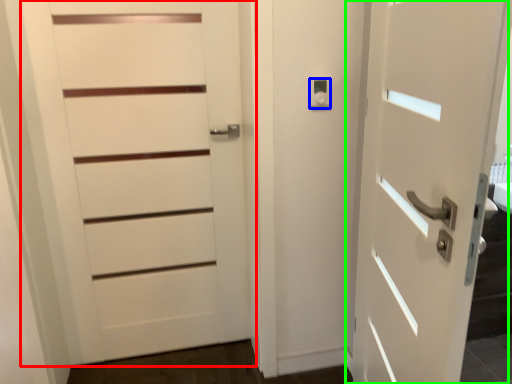
Question: Which is farther away from door (highlighted by a red box)? knob (highlighted by a blue box) or door (highlighted by a green box)?

Choices:
 (A) knob
 (B) door

Answer: (B)